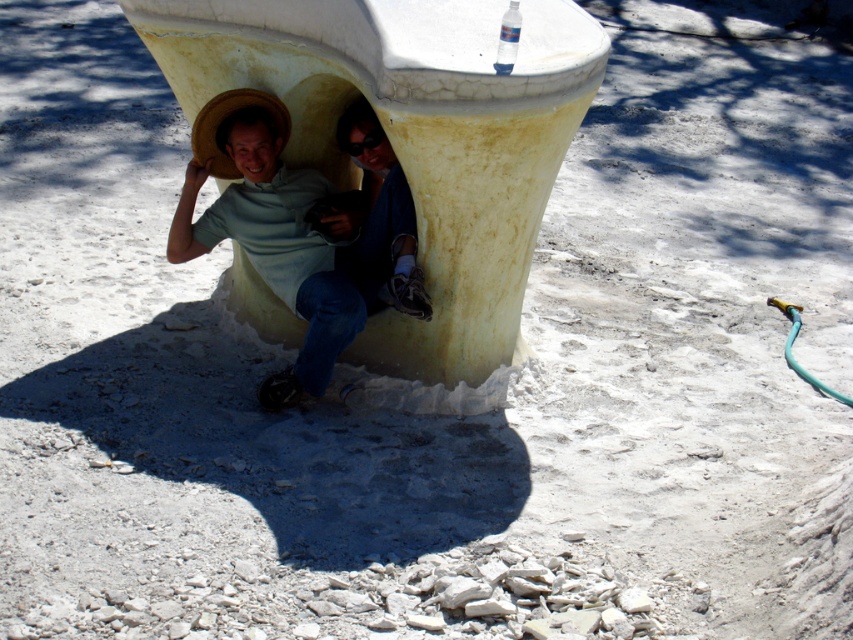
Who is positioned more to the left, matte straw hat at center or matte blue jeans at center?

matte straw hat at center is more to the left.

Can you confirm if matte straw hat at center is positioned above matte blue jeans at center?

No.

Is point (311, 310) farther from viewer compared to point (402, 301)?

Yes, point (311, 310) is behind point (402, 301).

The height and width of the screenshot is (640, 853). What are the coordinates of `matte straw hat at center` in the screenshot? It's located at (271, 228).

The image size is (853, 640). Identify the location of yellow cracked concrete pillar at center. [415, 148].

Is point (576, 35) more distant than point (236, 132)?

That is False.

Is point (236, 298) less distant than point (337, 308)?

No, it is behind (337, 308).

Where is `yellow cracked concrete pillar at center`? The width and height of the screenshot is (853, 640). yellow cracked concrete pillar at center is located at coordinates (415, 148).

Between yellow cracked concrete pillar at center and matte blue jeans at center, which one is positioned lower?

matte blue jeans at center

Which of these two, yellow cracked concrete pillar at center or matte blue jeans at center, stands taller?

yellow cracked concrete pillar at center

Which is in front, point (403, 60) or point (415, 250)?

Point (403, 60) is in front.

I want to click on yellow cracked concrete pillar at center, so [415, 148].